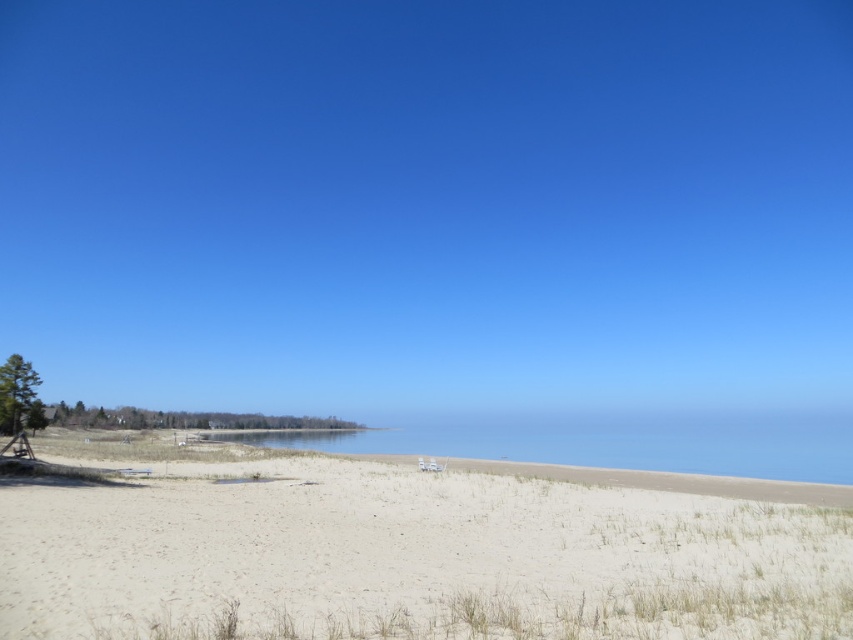
You are standing on the white sandy beach at lower left and want to reach the blue water at center. Which direction should you walk to get there?

You should walk to the right because the white sandy beach at lower left is positioned on the left side of blue water at center, so moving right would lead you towards the blue water at center.

You are standing at the point marked by the coordinates point [413,560], which is on the white sandy beach at lower left. You want to walk towards the two white chairs near the shoreline. Which direction should you head?

The point [413,560] is located at the white sandy beach at lower left. To reach the two white chairs near the shoreline, you should head towards the upper right direction since the shoreline and chairs are positioned in that direction relative to the lower left beach area.